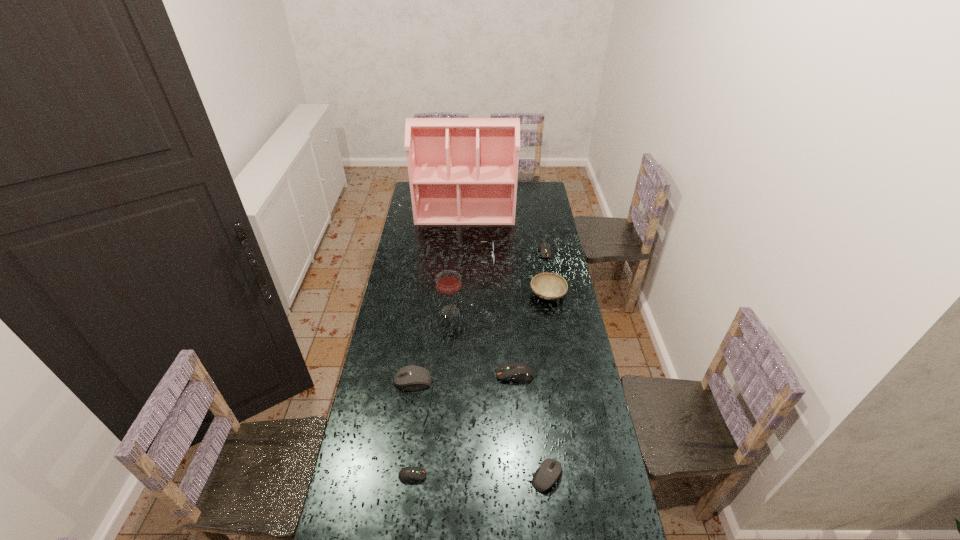
Image resolution: width=960 pixels, height=540 pixels. Identify the location of the tallest object. (462, 171).

This screenshot has width=960, height=540. Find the location of `the farthest object`. the farthest object is located at coordinates (462, 171).

Where is `red wineglass`? Image resolution: width=960 pixels, height=540 pixels. red wineglass is located at coordinates pos(448,282).

In order to click on the second tallest object in this screenshot , I will do `click(448, 282)`.

This screenshot has height=540, width=960. Identify the location of bowl. (548, 286).

Where is `spectacles`? The width and height of the screenshot is (960, 540). spectacles is located at coordinates (470, 241).

The width and height of the screenshot is (960, 540). In order to click on the second farthest dark computer equipment in this screenshot , I will do `click(518, 372)`.

The image size is (960, 540). What are the coordinates of `the second dark computer equipment from right to left` in the screenshot? It's located at (518, 372).

The height and width of the screenshot is (540, 960). I want to click on the farther black computer equipment, so click(413, 377).

You are a GUI agent. You are given a task and a screenshot of the screen. Output one action in this format:
    pyautogui.click(x=<x>, y=<y>)
    Task: Click on the left black computer equipment
    
    Given the screenshot: What is the action you would take?
    tap(413, 377)